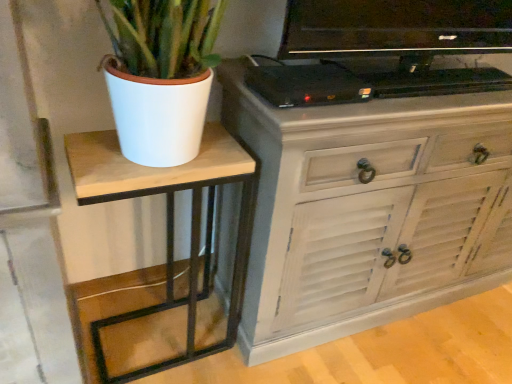
The height and width of the screenshot is (384, 512). In order to click on wooden table at left in this screenshot , I will do `click(170, 223)`.

At what (x,y) coordinates should I click in order to perform the action: click on black plastic device at upper center. Please return your answer as a coordinate pair (x, y). Looking at the image, I should click on (307, 85).

Can you confirm if wooden table at left is wider than black glossy television at upper center?

Indeed, wooden table at left has a greater width compared to black glossy television at upper center.

How different are the orientations of wooden table at left and black glossy television at upper center in degrees?

The angle between the facing direction of wooden table at left and the facing direction of black glossy television at upper center is 1.06 degrees.

From a real-world perspective, is wooden table at left positioned above or below black glossy television at upper center?

wooden table at left is below black glossy television at upper center.

Is distressed white cabinet at center wider or thinner than black glossy television at upper center?

distressed white cabinet at center is wider than black glossy television at upper center.

Can we say distressed white cabinet at center lies outside black glossy television at upper center?

That's correct, distressed white cabinet at center is outside of black glossy television at upper center.

Does distressed white cabinet at center have a larger size compared to black glossy television at upper center?

Correct, distressed white cabinet at center is larger in size than black glossy television at upper center.

From the image's perspective, is distressed white cabinet at center located above black glossy television at upper center?

No, from the image's perspective, distressed white cabinet at center is not on top of black glossy television at upper center.

Which object is further away from the camera taking this photo, black plastic device at upper center or wooden table at left?

black plastic device at upper center is further from the camera.

Do you think black plastic device at upper center is within wooden table at left, or outside of it?

black plastic device at upper center is not inside wooden table at left, it's outside.

Is black plastic device at upper center next to wooden table at left and touching it?

No, black plastic device at upper center is not touching wooden table at left.

How much distance is there between distressed white cabinet at center and wooden table at left?

A distance of 15.34 inches exists between distressed white cabinet at center and wooden table at left.

Looking at this image, which is farther from the camera, [286,276] or [240,260]?

The point [240,260] is behind.

How many degrees apart are the facing directions of distressed white cabinet at center and wooden table at left?

The facing directions of distressed white cabinet at center and wooden table at left are 0.713 degrees apart.

Considering the positions of objects distressed white cabinet at center and wooden table at left in the image provided, who is in front, distressed white cabinet at center or wooden table at left?

distressed white cabinet at center is in front.

In the scene shown: Which of these two, black glossy television at upper center or black plastic device at upper center, is wider?

black glossy television at upper center is wider.

Can you tell me how much black glossy television at upper center and black plastic device at upper center differ in facing direction?

They differ by 1.59 degrees in their facing directions.

Would you consider black glossy television at upper center to be distant from black plastic device at upper center?

Actually, black glossy television at upper center and black plastic device at upper center are a little close together.

Which point is more distant from viewer, (401, 95) or (312, 72)?

The point (401, 95) is behind.

Does black plastic device at upper center lie in front of black glossy television at upper center?

That is False.

Is black plastic device at upper center at the right side of black glossy television at upper center?

No.

Is black plastic device at upper center directly adjacent to black glossy television at upper center?

No.

Considering the positions of point (192, 274) and point (359, 101), is point (192, 274) closer or farther from the camera than point (359, 101)?

Clearly, point (192, 274) is more distant from the camera than point (359, 101).

From the image's perspective, between wooden table at left and black plastic device at upper center, who is located below?

wooden table at left appears lower in the image.

The width and height of the screenshot is (512, 384). I want to click on table in front of the black plastic device at upper center, so click(170, 223).

This screenshot has height=384, width=512. I want to click on television lying in front of the wooden table at left, so click(x=402, y=41).

What are the coordinates of `chest of drawers to the right of black glossy television at upper center` in the screenshot? It's located at (368, 210).

Based on their spatial positions, is black glossy television at upper center or black plastic device at upper center further from wooden table at left?

black glossy television at upper center lies further to wooden table at left than the other object.

When comparing their distances from distressed white cabinet at center, does black glossy television at upper center or black plastic device at upper center seem closer?

Among the two, black glossy television at upper center is located nearer to distressed white cabinet at center.

Based on their spatial positions, is wooden table at left or distressed white cabinet at center closer to black plastic device at upper center?

The object closer to black plastic device at upper center is distressed white cabinet at center.

Looking at the image, which one is located further to black glossy television at upper center, wooden table at left or black plastic device at upper center?

wooden table at left is positioned further to the anchor black glossy television at upper center.

Looking at the image, which one is located further to black glossy television at upper center, distressed white cabinet at center or wooden table at left?

The object further to black glossy television at upper center is wooden table at left.

Considering their positions, is wooden table at left positioned closer to distressed white cabinet at center than black glossy television at upper center?

The object closer to distressed white cabinet at center is black glossy television at upper center.

Based on their spatial positions, is distressed white cabinet at center or wooden table at left further from black plastic device at upper center?

Based on the image, wooden table at left appears to be further to black plastic device at upper center.

When comparing their distances from wooden table at left, does distressed white cabinet at center or black plastic device at upper center seem closer?

distressed white cabinet at center is positioned closer to the anchor wooden table at left.

This screenshot has width=512, height=384. Identify the location of appliance situated between wooden table at left and black glossy television at upper center from left to right. (307, 85).

Locate an element on the screen. The image size is (512, 384). television between wooden table at left and distressed white cabinet at center in the horizontal direction is located at coordinates (402, 41).

Find the location of a particular element. This screenshot has width=512, height=384. television between black plastic device at upper center and distressed white cabinet at center is located at coordinates (402, 41).

Where is `appliance between wooden table at left and distressed white cabinet at center from left to right`? The width and height of the screenshot is (512, 384). appliance between wooden table at left and distressed white cabinet at center from left to right is located at coordinates (307, 85).